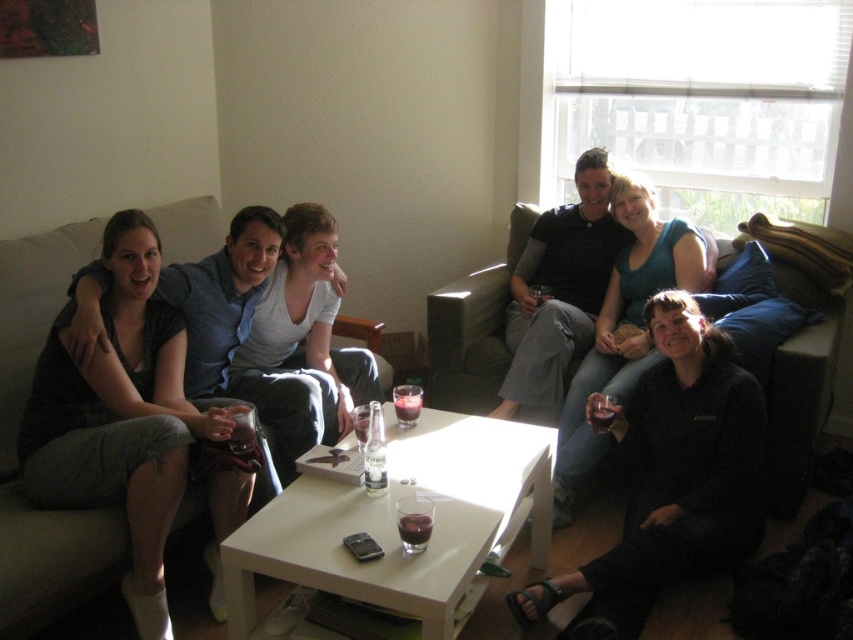
Is matte black shirt at center positioned in front of dark gray leather couch at center?

Yes.

Is matte black shirt at center below dark gray leather couch at center?

Yes, matte black shirt at center is below dark gray leather couch at center.

Between point (566, 506) and point (445, 364), which one is positioned behind?

Positioned behind is point (445, 364).

The height and width of the screenshot is (640, 853). I want to click on matte black shirt at center, so click(x=625, y=323).

Is dark gray fabric couch at left taller than translucent glass at coffee table?

Indeed, dark gray fabric couch at left has a greater height compared to translucent glass at coffee table.

Between point (44, 612) and point (415, 388), which one is positioned in front?

Point (44, 612) is in front.

Who is more forward, (16, 525) or (419, 392)?

Point (16, 525) is in front.

You are a GUI agent. You are given a task and a screenshot of the screen. Output one action in this format:
    pyautogui.click(x=<x>, y=<y>)
    Task: Click on the dark gray fabric couch at left
    Image resolution: width=853 pixels, height=640 pixels.
    Given the screenshot: What is the action you would take?
    pyautogui.click(x=42, y=568)

Which is behind, point (454, 353) or point (247, 429)?

The point (454, 353) is behind.

Does dark gray leather couch at center have a larger size compared to translucent glass wine at center?

Indeed, dark gray leather couch at center has a larger size compared to translucent glass wine at center.

Which is in front, point (483, 374) or point (254, 432)?

Point (254, 432) is more forward.

At what (x,y) coordinates should I click in order to perform the action: click on dark gray leather couch at center. Please return your answer as a coordinate pair (x, y). This screenshot has width=853, height=640. Looking at the image, I should click on 473,326.